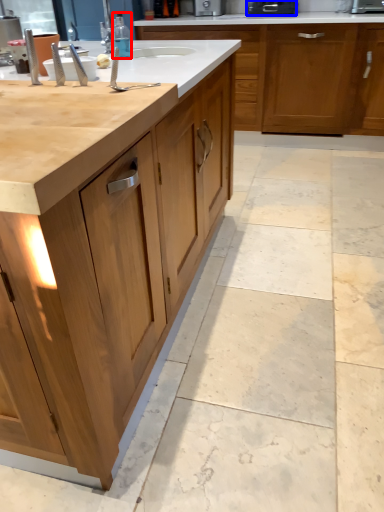
Question: Which point is closer to the camera, bottle (highlighted by a red box) or appliance (highlighted by a blue box)?

Choices:
 (A) bottle
 (B) appliance

Answer: (A)